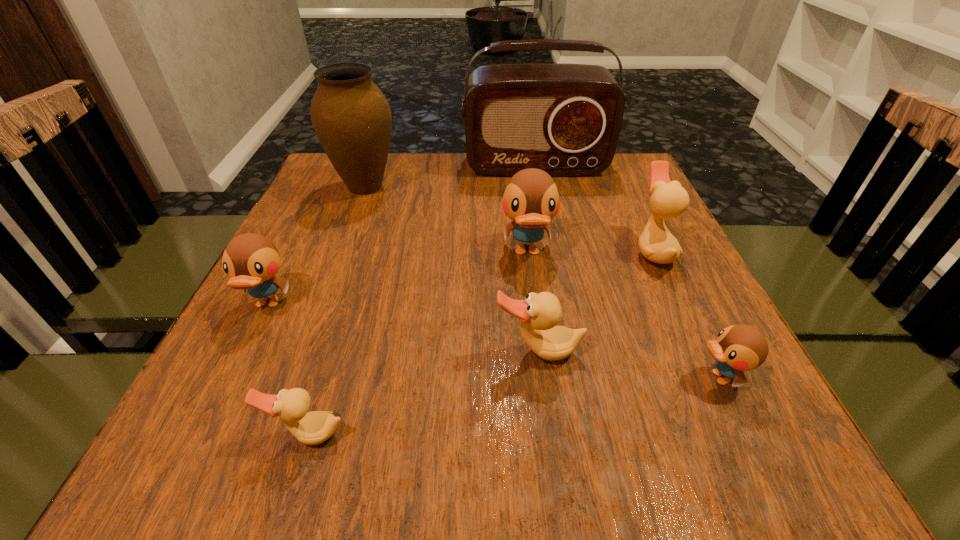
Find the location of a particular element. This screenshot has width=960, height=540. object identified as the fourth closest to the second tan duck from left to right is located at coordinates (311, 428).

This screenshot has height=540, width=960. Find the location of `duck object that ranks as the second closest to the second blue duck from right to left`. duck object that ranks as the second closest to the second blue duck from right to left is located at coordinates (669, 199).

Identify which duck is the fifth nearest to the second blue duck from right to left. Please provide its 2D coordinates. Your answer should be formatted as a tuple, i.e. [(x, y)], where the tuple contains the x and y coordinates of a point satisfying the conditions above.

[(311, 428)]

Find the location of a particular element. The width and height of the screenshot is (960, 540). blue duck that is the closest one to the biggest blue duck is located at coordinates (738, 348).

Identify which blue duck is the third nearest to the radio receiver. Please provide its 2D coordinates. Your answer should be formatted as a tuple, i.e. [(x, y)], where the tuple contains the x and y coordinates of a point satisfying the conditions above.

[(738, 348)]

Identify which tan duck is the closest to the smallest blue duck. Please provide its 2D coordinates. Your answer should be formatted as a tuple, i.e. [(x, y)], where the tuple contains the x and y coordinates of a point satisfying the conditions above.

[(539, 313)]

Identify which tan duck is the third nearest to the smallest blue duck. Please provide its 2D coordinates. Your answer should be formatted as a tuple, i.e. [(x, y)], where the tuple contains the x and y coordinates of a point satisfying the conditions above.

[(311, 428)]

The width and height of the screenshot is (960, 540). What are the coordinates of `free point that satisfies the following two spatial constraints: 1. on the front-facing side of the nearest blue duck; 2. on the beak of the leftmost tan duck` in the screenshot? It's located at (746, 434).

Where is `vacant area in the image that satisfies the following two spatial constraints: 1. on the beak of the rightmost tan duck; 2. on the beak of the second smallest tan duck`? vacant area in the image that satisfies the following two spatial constraints: 1. on the beak of the rightmost tan duck; 2. on the beak of the second smallest tan duck is located at coordinates (699, 352).